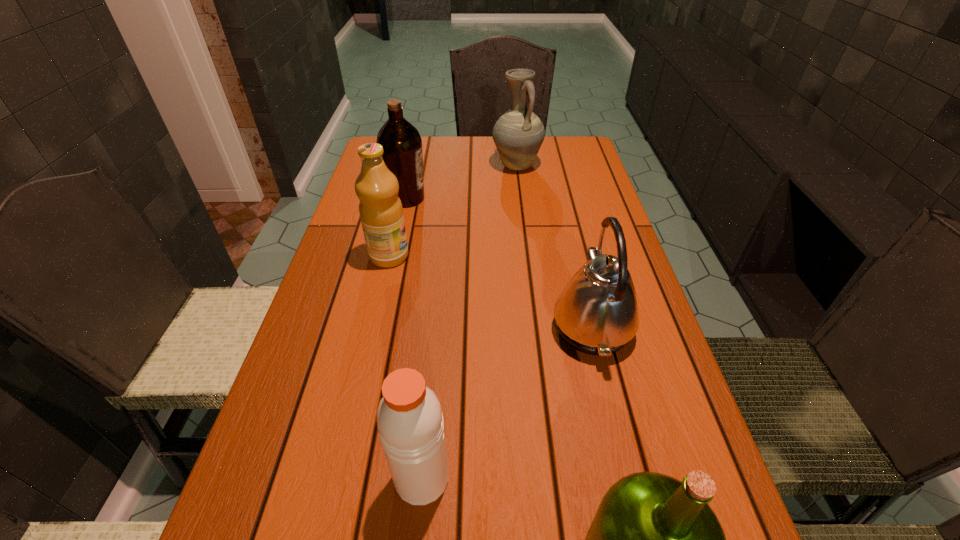
Locate an element on the screen. free spot between the second farthest olive oil and the second nearest object is located at coordinates (406, 367).

Identify the location of free space between the kettle and the fifth nearest object. The height and width of the screenshot is (540, 960). (499, 263).

Identify which object is located as the second nearest to the third farthest object. Please provide its 2D coordinates. Your answer should be formatted as a tuple, i.e. [(x, y)], where the tuple contains the x and y coordinates of a point satisfying the conditions above.

[(596, 313)]

Identify the location of object that is the fourth closest one to the nearest olive oil. (402, 144).

Select which olive oil appears as the closest to the rightmost olive oil. Please provide its 2D coordinates. Your answer should be formatted as a tuple, i.e. [(x, y)], where the tuple contains the x and y coordinates of a point satisfying the conditions above.

[(381, 212)]

Locate which olive oil is the closest to the farthest olive oil. Please provide its 2D coordinates. Your answer should be formatted as a tuple, i.e. [(x, y)], where the tuple contains the x and y coordinates of a point satisfying the conditions above.

[(381, 212)]

The image size is (960, 540). I want to click on free location that satisfies the following two spatial constraints: 1. on the label of the fifth farthest object; 2. on the left side of the farthest olive oil, so click(x=345, y=478).

What are the coordinates of `free location that satisfies the following two spatial constraints: 1. on the label of the farthest olive oil; 2. on the left side of the shaker` in the screenshot? It's located at (345, 478).

The height and width of the screenshot is (540, 960). Identify the location of vacant region that satisfies the following two spatial constraints: 1. on the handle side of the farthest object; 2. on the label of the third farthest object. (528, 256).

This screenshot has width=960, height=540. I want to click on blank space that satisfies the following two spatial constraints: 1. on the label of the farthest olive oil; 2. on the back side of the shaker, so click(345, 478).